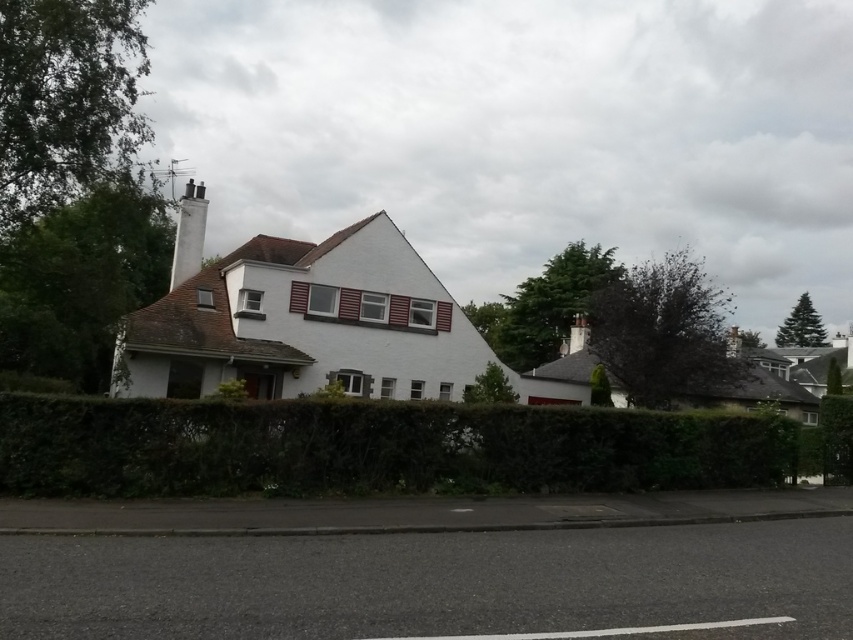
Based on the photo, you are a visitor arriving at the house and notice the green leafy hedge at lower center and the white smooth chimney at upper center. Which object is taller?

The green leafy hedge at lower center is not as tall as the white smooth chimney at upper center, so the white smooth chimney at upper center is taller.

You are standing on the road in front of the house. Which object would you see first as you look towards the house, the green leafy hedge at lower center or the white smooth chimney at upper center?

The green leafy hedge at lower center is in front of the white smooth chimney at upper center, so you would see the green leafy hedge at lower center first when looking towards the house.

You are standing at the front door of the house and want to walk to the green leafy hedge at lower center. What direction should you walk to reach it?

The green leafy hedge at lower center is located at point (x=375, y=448). Since you are at the front door, you should walk forward towards the lower center direction to reach it.